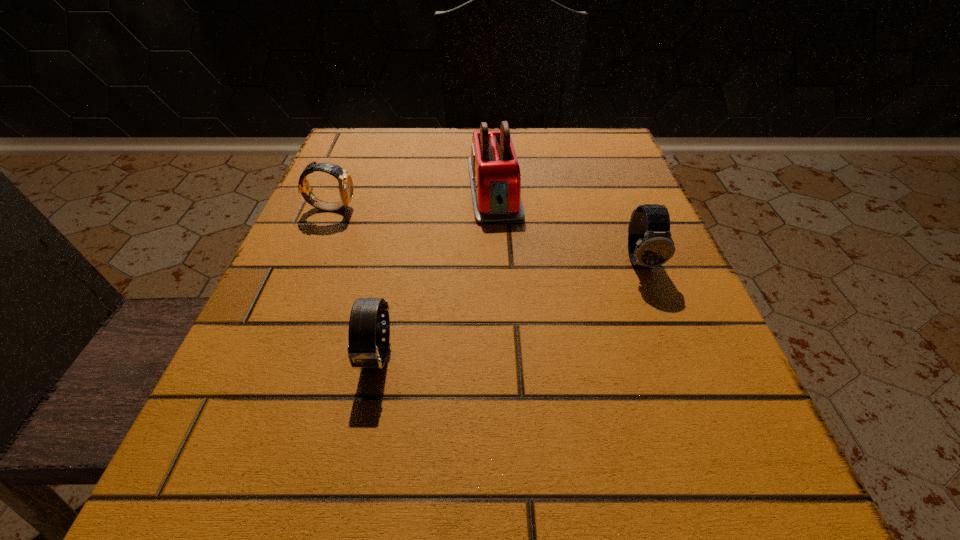
Locate an element on the screen. The width and height of the screenshot is (960, 540). free space located on the face of the farthest watch is located at coordinates (465, 207).

This screenshot has width=960, height=540. Identify the location of free space located 0.050m on the face of the nearest watch. (363, 420).

Identify the location of object that is at the far edge. This screenshot has width=960, height=540. (495, 178).

Locate an element on the screen. Image resolution: width=960 pixels, height=540 pixels. object that is positioned at the left edge is located at coordinates (345, 182).

Where is `object positioned at the right edge`? The width and height of the screenshot is (960, 540). object positioned at the right edge is located at coordinates (650, 244).

This screenshot has height=540, width=960. Identify the location of vacant space at the far edge of the desktop. (468, 136).

At what (x,y) coordinates should I click in order to perform the action: click on free space at the left edge of the desktop. Please return your answer as a coordinate pair (x, y). This screenshot has width=960, height=540. Looking at the image, I should click on (337, 253).

In the image, there is a desktop. What are the coordinates of `vacant space at the right edge` in the screenshot? It's located at (679, 438).

You are a GUI agent. You are given a task and a screenshot of the screen. Output one action in this format:
    pyautogui.click(x=<x>, y=<y>)
    Task: Click on the vacant space at the far left corner of the desktop
    The width and height of the screenshot is (960, 540).
    Given the screenshot: What is the action you would take?
    pyautogui.click(x=389, y=165)

Identify the location of vacant space at the far right corner of the desktop. (598, 129).